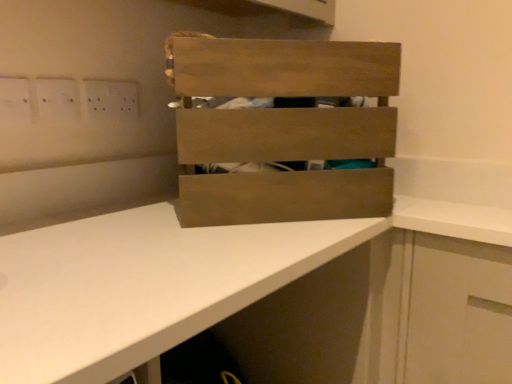
Identify the location of blank space situated above white matte countertop at center (from a real-world perspective). (174, 235).